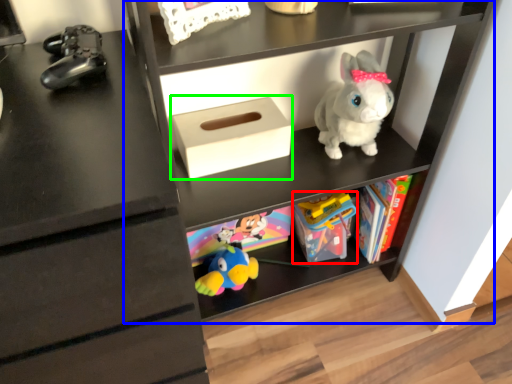
Question: Which object is positioned closest to toy (highlighted by a red box)? Select from shelf (highlighted by a blue box) and shoe box (highlighted by a green box).

Choices:
 (A) shelf
 (B) shoe box

Answer: (A)